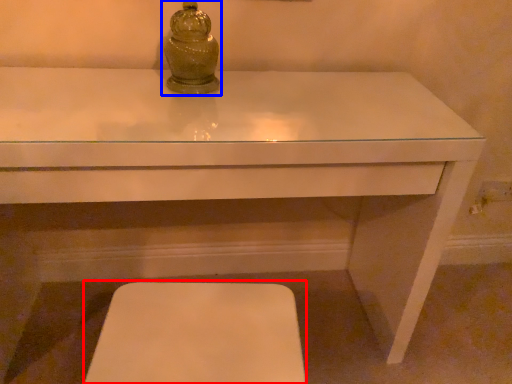
Question: Which object is closer to the camera taking this photo, step stool (highlighted by a red box) or candle holder (highlighted by a blue box)?

Choices:
 (A) step stool
 (B) candle holder

Answer: (A)